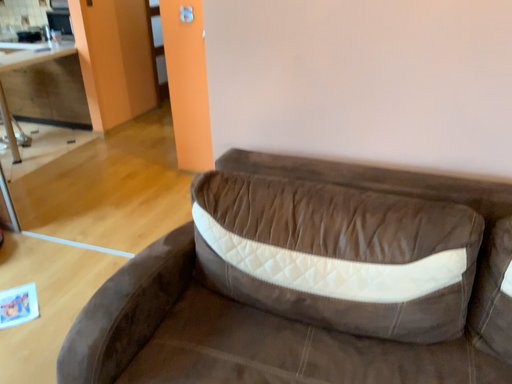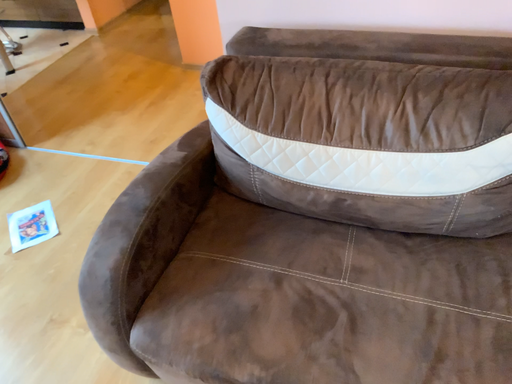
Question: Which way did the camera rotate in the video?

Choices:
 (A) rotated upward
 (B) rotated downward

Answer: (B)